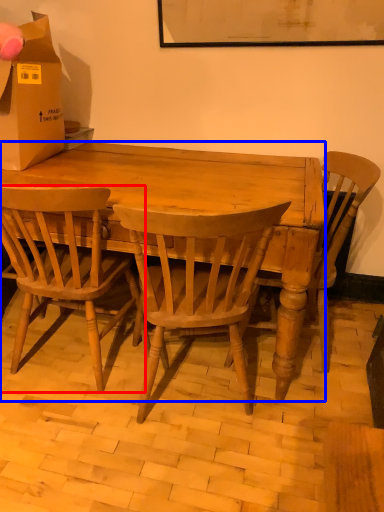
Question: Which of the following is the closest to the observer, chair (highlighted by a red box) or desk (highlighted by a blue box)?

Choices:
 (A) chair
 (B) desk

Answer: (A)